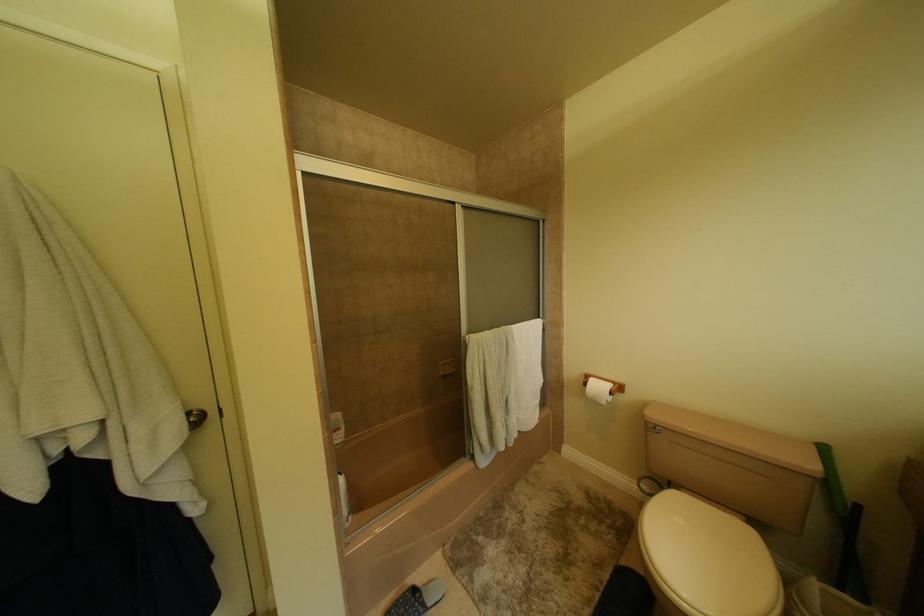
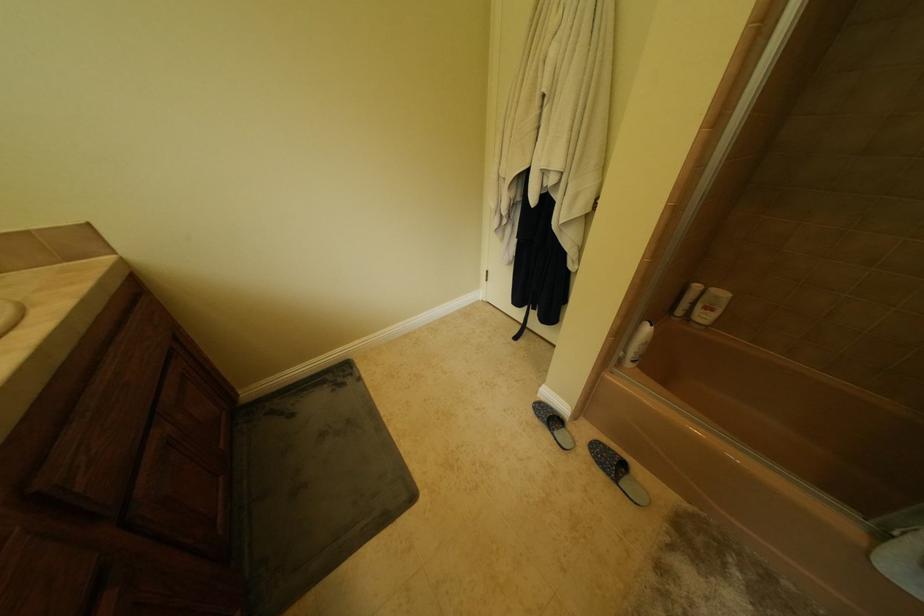
How did the camera likely rotate?

The camera's rotation is toward left-down.